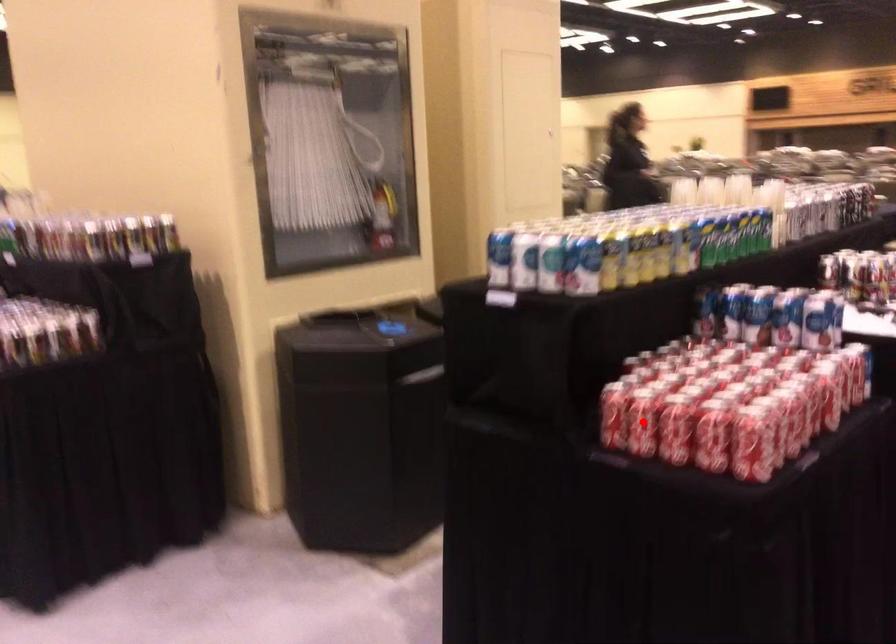
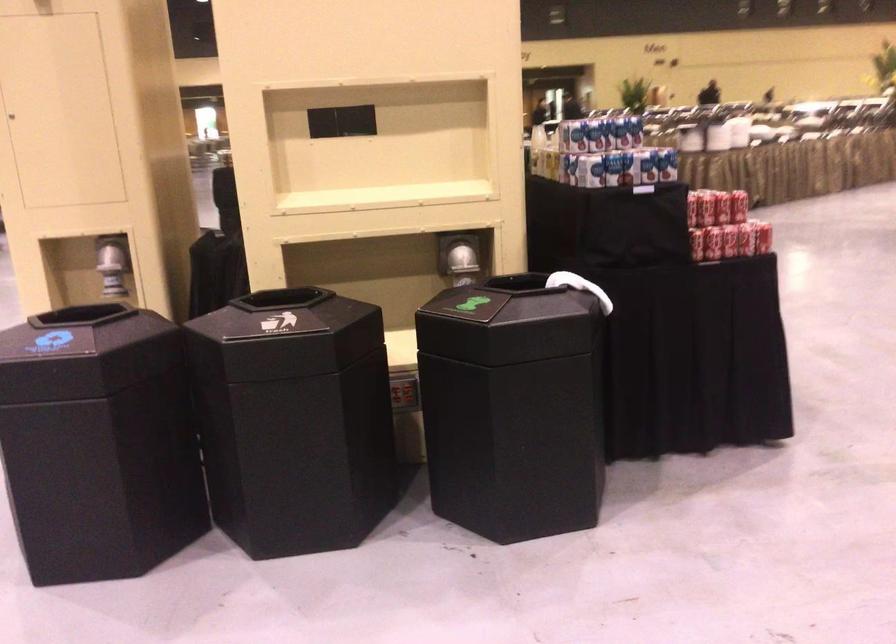
Question: I am providing you with two images of the same scene from different viewpoints. A red point is marked on the first image. Is the red point's position out of view in image 2?

Choices:
 (A) Yes
 (B) No

Answer: (A)